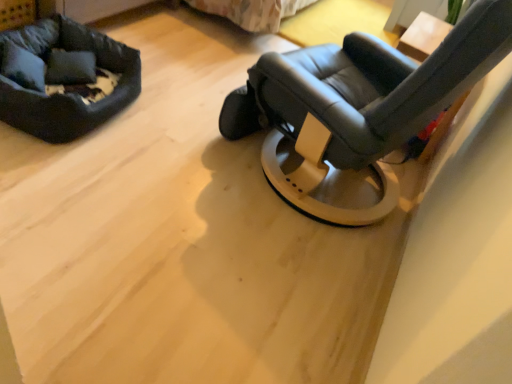
I want to click on free space between matte black chair at center and soft gray fabric pillow at upper left, so click(191, 135).